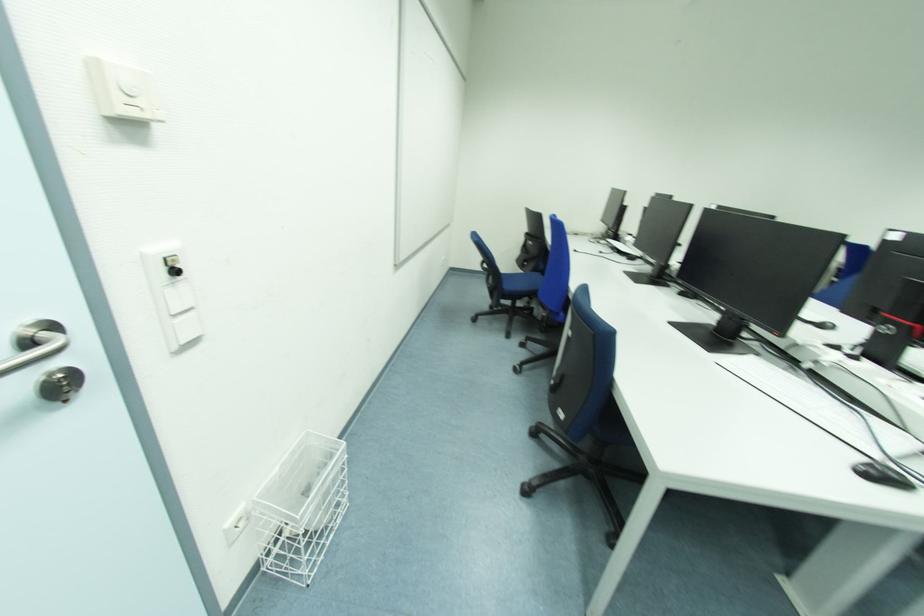
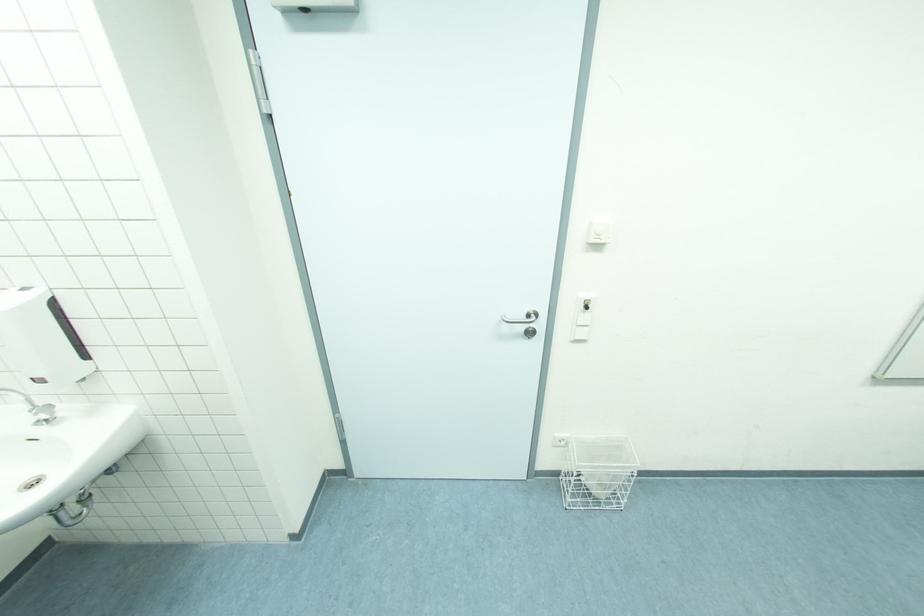
The images are taken continuously from a first-person perspective. In which direction is your viewpoint rotating?

The camera's rotation is toward left-down.